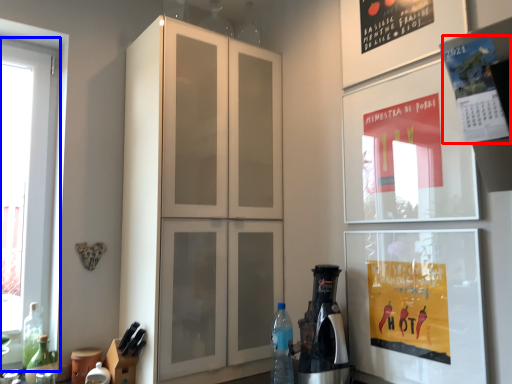
Question: Among these objects, which one is nearest to the camera, poster (highlighted by a red box) or window (highlighted by a blue box)?

Choices:
 (A) poster
 (B) window

Answer: (A)